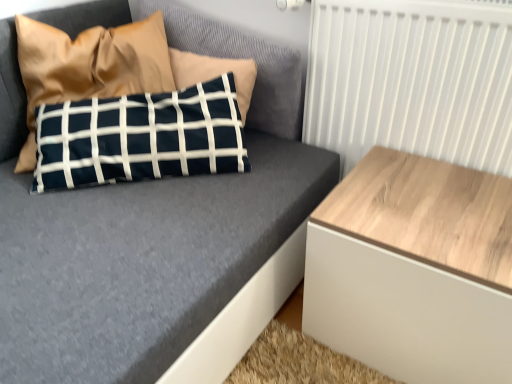
Question: Is white wood radiator at upper right touching navy blue fabric pillow at upper left?

Choices:
 (A) yes
 (B) no

Answer: (B)

Question: From a real-world perspective, is white wood radiator at upper right under navy blue fabric pillow at upper left?

Choices:
 (A) yes
 (B) no

Answer: (A)

Question: Considering the relative sizes of white wood radiator at upper right and navy blue fabric pillow at upper left in the image provided, is white wood radiator at upper right shorter than navy blue fabric pillow at upper left?

Choices:
 (A) no
 (B) yes

Answer: (A)

Question: Could you tell me if white wood radiator at upper right is turned towards navy blue fabric pillow at upper left?

Choices:
 (A) yes
 (B) no

Answer: (B)

Question: Would you say white wood radiator at upper right is a long distance from navy blue fabric pillow at upper left?

Choices:
 (A) yes
 (B) no

Answer: (B)

Question: Is point (106, 72) positioned closer to the camera than point (320, 324)?

Choices:
 (A) closer
 (B) farther

Answer: (B)

Question: Looking at their shapes, would you say navy blue fabric pillow at upper left is wider or thinner than light wood/texture side table at right?

Choices:
 (A) wide
 (B) thin

Answer: (B)

Question: Which is correct: navy blue fabric pillow at upper left is inside light wood/texture side table at right, or outside of it?

Choices:
 (A) inside
 (B) outside

Answer: (B)

Question: Would you say navy blue fabric pillow at upper left is to the left or to the right of light wood/texture side table at right in the picture?

Choices:
 (A) right
 (B) left

Answer: (B)

Question: From a real-world perspective, is light wood/texture side table at right positioned above or below white wood radiator at upper right?

Choices:
 (A) below
 (B) above

Answer: (A)

Question: In terms of height, does light wood/texture side table at right look taller or shorter compared to white wood radiator at upper right?

Choices:
 (A) tall
 (B) short

Answer: (B)

Question: Looking at their shapes, would you say light wood/texture side table at right is wider or thinner than white wood radiator at upper right?

Choices:
 (A) wide
 (B) thin

Answer: (A)

Question: Is light wood/texture side table at right bigger or smaller than white wood radiator at upper right?

Choices:
 (A) small
 (B) big

Answer: (B)

Question: From a real-world perspective, relative to light wood/texture side table at right, is white wood radiator at upper right vertically above or below?

Choices:
 (A) above
 (B) below

Answer: (A)

Question: Based on their sizes in the image, would you say white wood radiator at upper right is bigger or smaller than light wood/texture side table at right?

Choices:
 (A) big
 (B) small

Answer: (B)